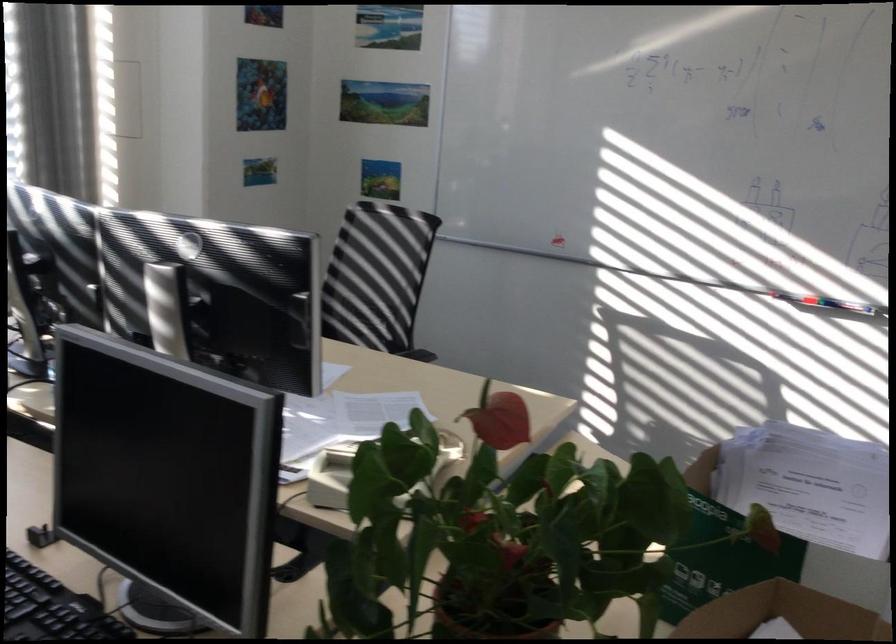
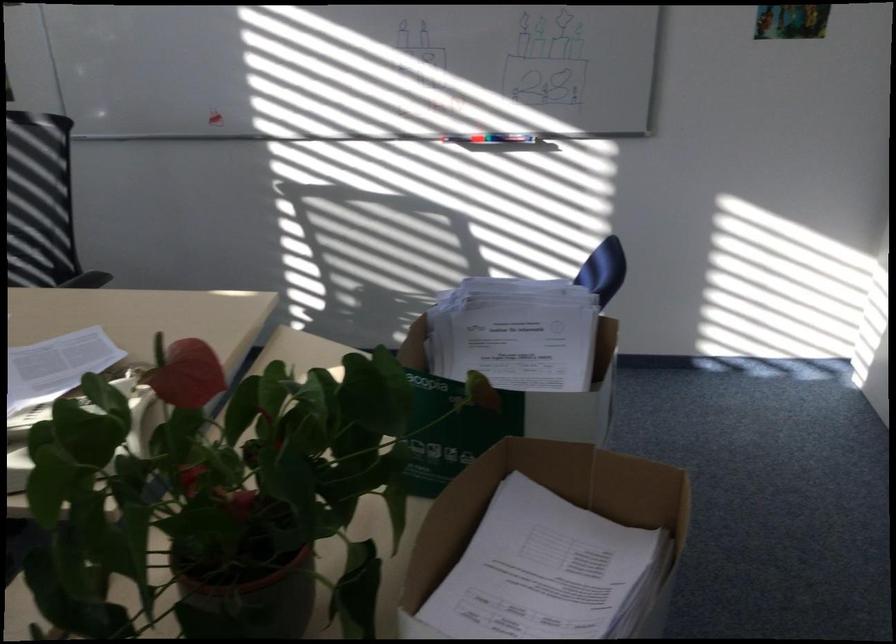
Question: The camera is either moving clockwise (left) or counter-clockwise (right) around the object. The first image is from the beginning of the video and the second image is from the end. Is the camera moving left or right when shooting the video?

Choices:
 (A) Left
 (B) Right

Answer: (A)